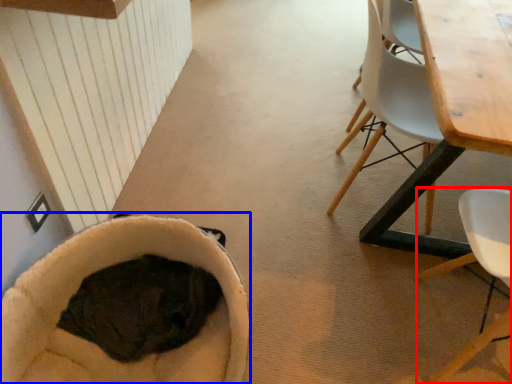
Question: Which object is further to the camera taking this photo, chair (highlighted by a red box) or bean bag chair (highlighted by a blue box)?

Choices:
 (A) chair
 (B) bean bag chair

Answer: (B)